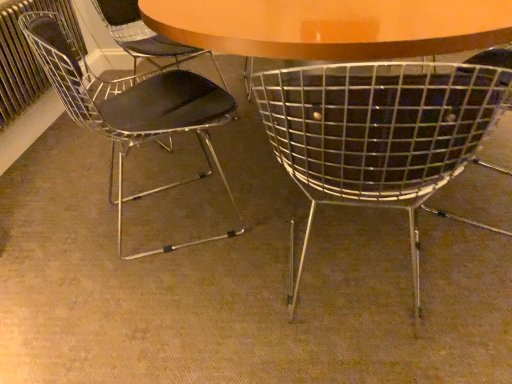
I want to click on vacant area that lies in front of metallic wire chair at left, which appears as the 2th chair when viewed from the right, so click(x=152, y=302).